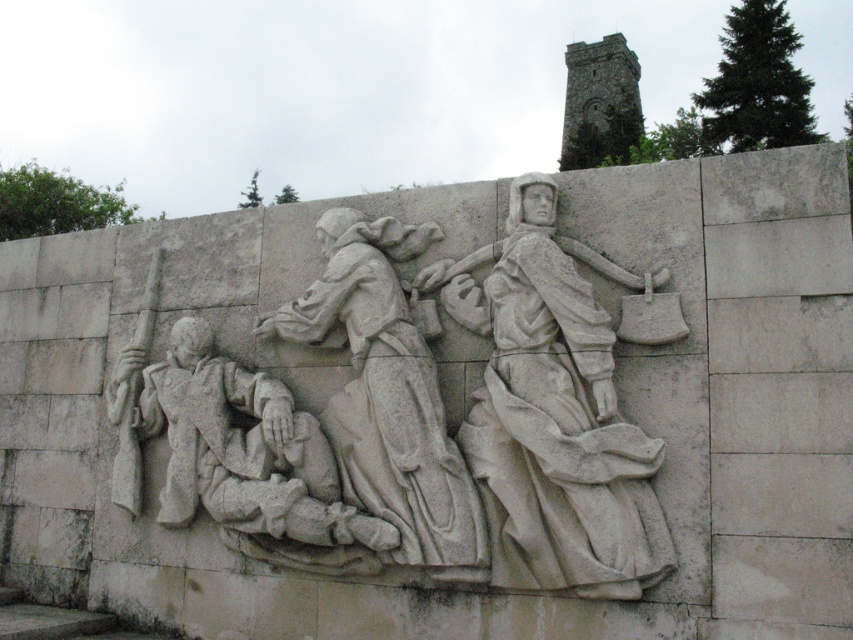
Question: Which point is closer to the camera?

Choices:
 (A) white stone figure at center
 (B) gray stone soldier at center

Answer: (A)

Question: Can you confirm if white stone figure at center is positioned to the right of gray stone figure at center?

Choices:
 (A) yes
 (B) no

Answer: (A)

Question: Which point appears closest to the camera in this image?

Choices:
 (A) (328, 440)
 (B) (575, 362)

Answer: (B)

Question: Among these objects, which one is farthest from the camera?

Choices:
 (A) white stone figure at center
 (B) gray stone figure at center
 (C) gray stone soldier at center

Answer: (C)

Question: In this image, where is white stone relief at center located relative to gray stone figure at center?

Choices:
 (A) right
 (B) left

Answer: (B)

Question: Can you confirm if white stone relief at center is positioned to the right of gray stone soldier at center?

Choices:
 (A) yes
 (B) no

Answer: (A)